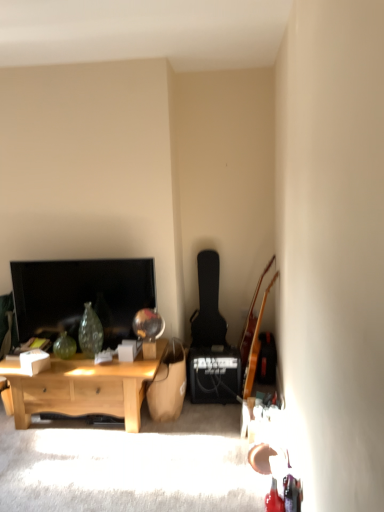
The image size is (384, 512). I want to click on free location in front of black matte speaker at lower right, so click(x=216, y=413).